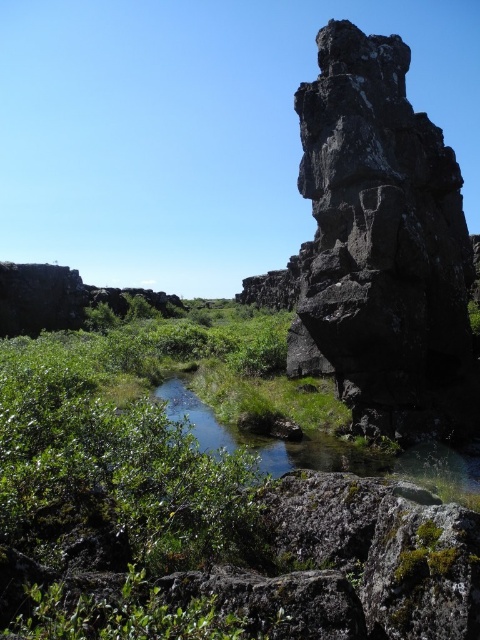
Question: Which point is farther to the camera?

Choices:
 (A) black rough rock at right
 (B) green leafy shrubs at center

Answer: (A)

Question: Does green leafy shrubs at center appear over black rough rock at right?

Choices:
 (A) no
 (B) yes

Answer: (A)

Question: Which object is farther from the camera taking this photo?

Choices:
 (A) green leafy shrubs at center
 (B) black rough rock at right

Answer: (B)

Question: Which point is closer to the camera?

Choices:
 (A) (348, 156)
 (B) (433, 484)

Answer: (B)

Question: Does green leafy shrubs at center appear over black rough rock at right?

Choices:
 (A) no
 (B) yes

Answer: (A)

Question: Does green leafy shrubs at center appear on the left side of black rough rock at right?

Choices:
 (A) no
 (B) yes

Answer: (B)